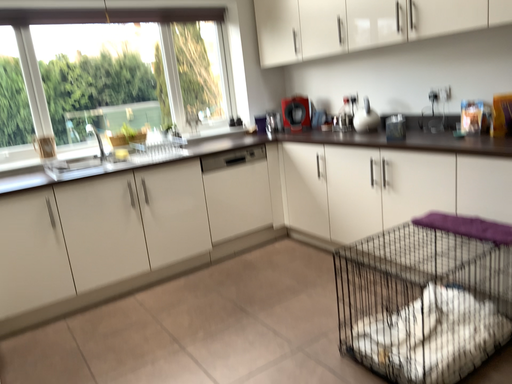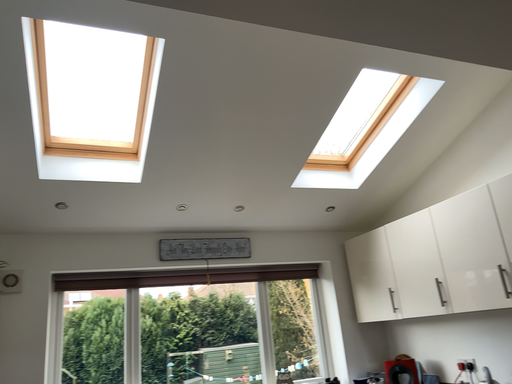
Question: Which way did the camera rotate in the video?

Choices:
 (A) rotated left
 (B) rotated right

Answer: (A)